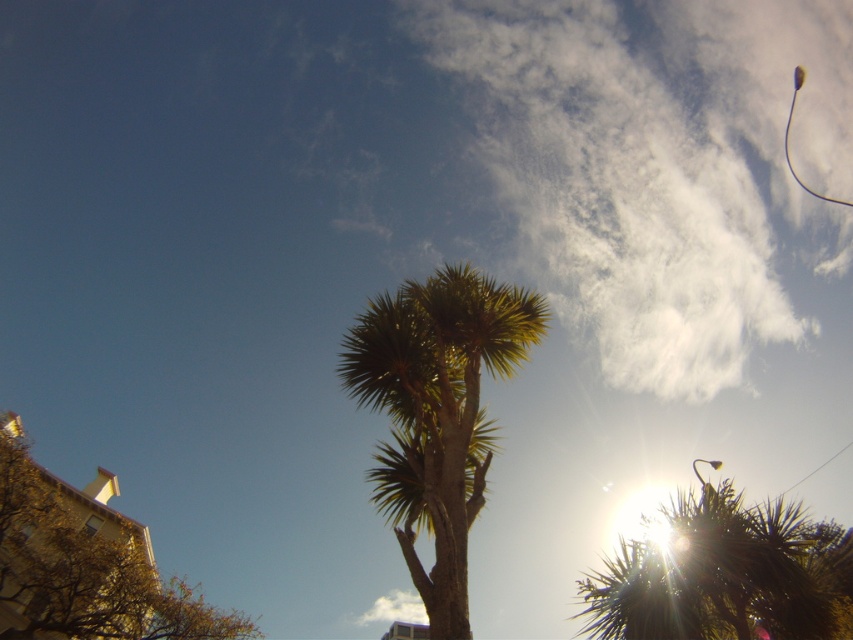
You are a city planner assessing the space between the green leafy palm tree at center and the brown textured tree at lower left for installing a new bench. Based on their heights, which tree is shorter and would allow more sunlight to reach the bench?

The green leafy palm tree at center has a lesser height compared to the brown textured tree at lower left, so it is shorter and would allow more sunlight to reach the bench.

You are standing in the middle of the image and want to walk towards the green spiky tree at center. In which direction should you move?

The green spiky tree at center is located at point 0.900 on the x axis and 0.851 on the y axis. Since you are at the center of the image, which is point 0.5 on both axes, you should move towards the right and slightly downward to reach the green spiky tree at center.

You are standing in the scene and want to place a small flag at both point [512,324] and point [80,548]. Which point will have the flag that is closer to your eyes?

The flag placed at point [512,324] will be closer to your eyes because the point is closer to the camera than point [80,548].